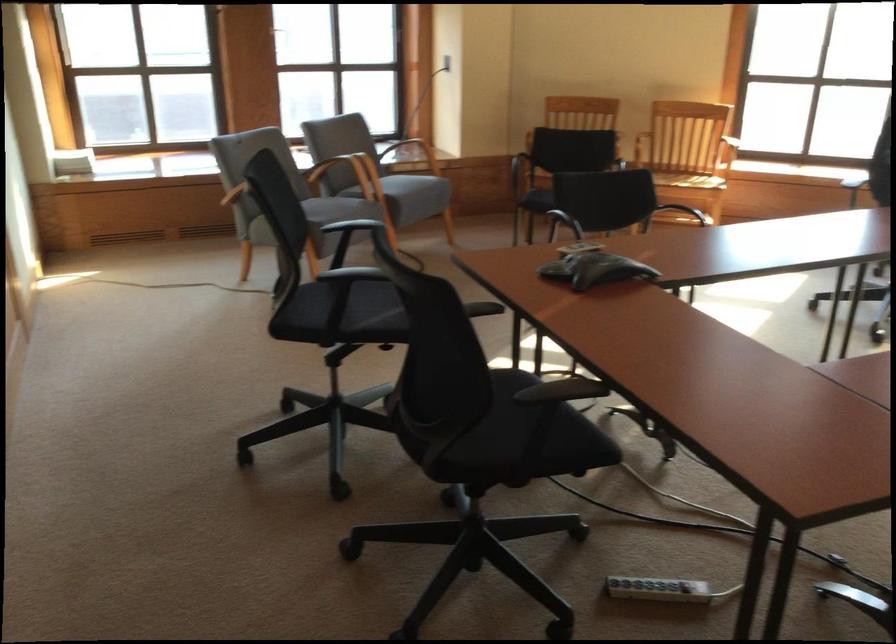
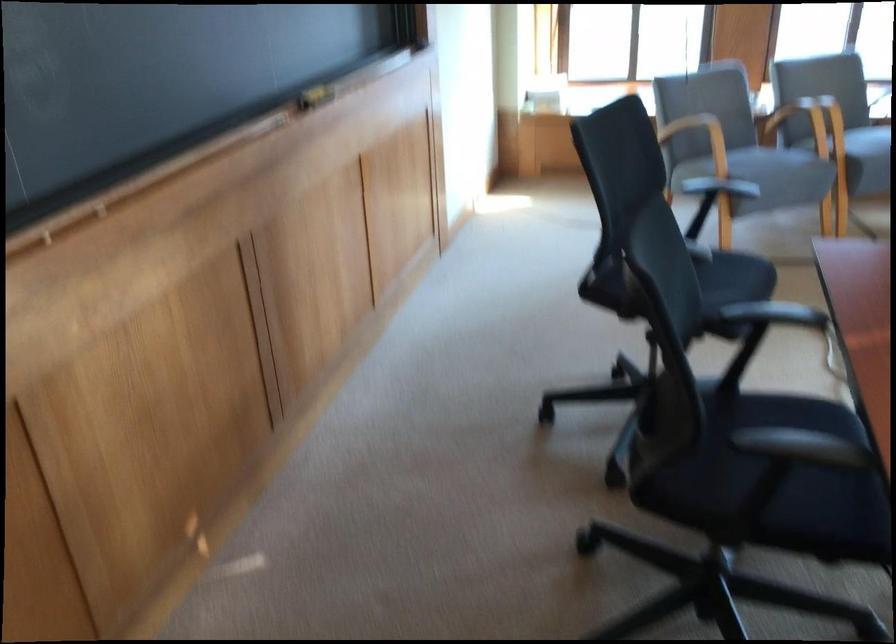
Find the pixel in the second image that matches [345,178] in the first image.

(799, 122)